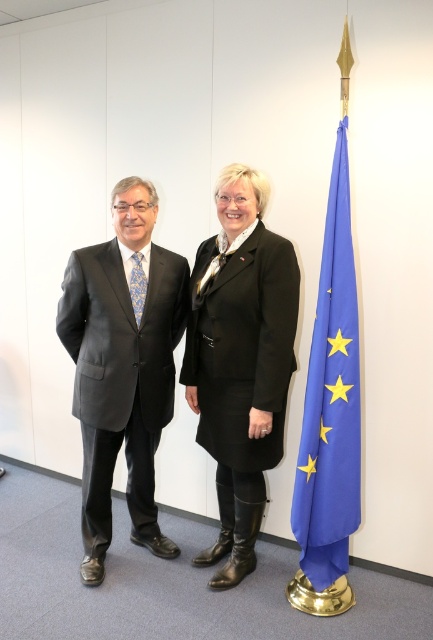
Which is in front, point (103, 385) or point (345, 385)?

Point (345, 385) is in front.

Does point (125, 209) lie behind point (326, 285)?

Yes, point (125, 209) is farther from viewer.

Locate an element on the screen. This screenshot has height=640, width=433. matte black suit at left is located at coordinates (122, 365).

Is point (129, 186) farther from viewer compared to point (229, 566)?

That is False.

Does point (148, 392) lie in front of point (287, 262)?

No, (148, 392) is further to viewer.

Identify the location of matte black suit at left. (122, 365).

Image resolution: width=433 pixels, height=640 pixels. What do you see at coordinates (241, 360) in the screenshot? I see `black leather coat at center` at bounding box center [241, 360].

Is point (190, 355) positioned behind point (325, 248)?

Yes, point (190, 355) is farther from viewer.

The image size is (433, 640). Describe the element at coordinates (241, 360) in the screenshot. I see `black leather coat at center` at that location.

Locate an element on the screen. black leather coat at center is located at coordinates (x=241, y=360).